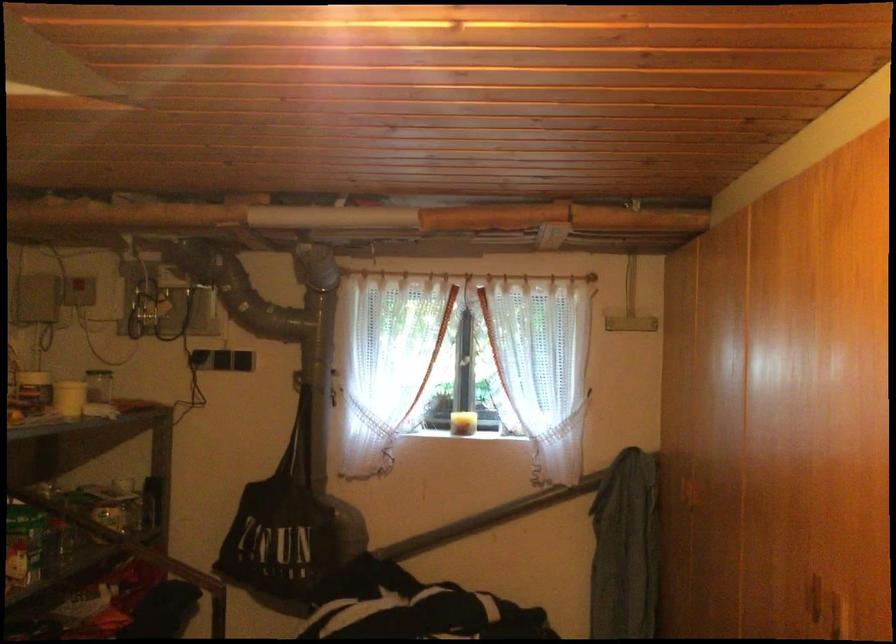
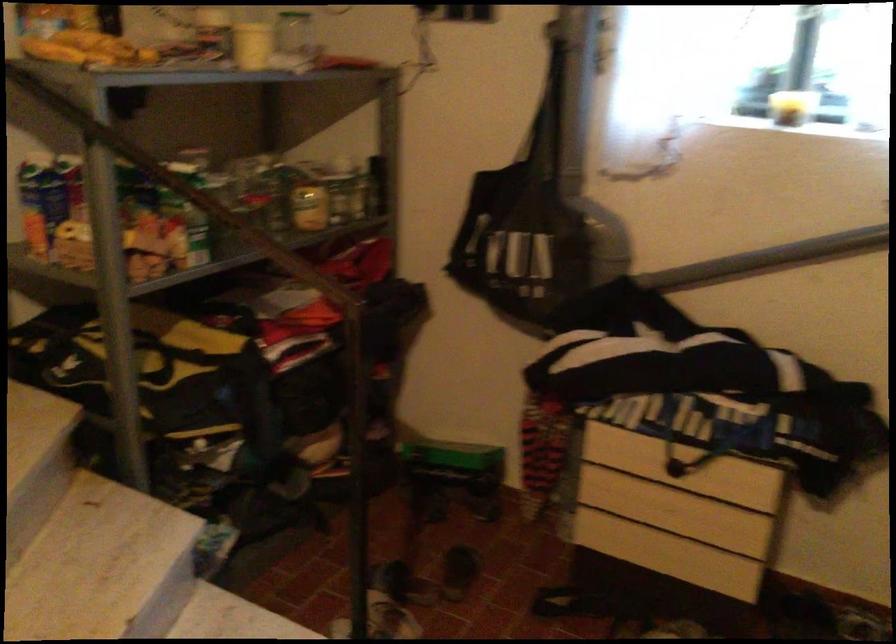
Where in the second image is the point corresponding to point 287,521 from the first image?

(526, 223)